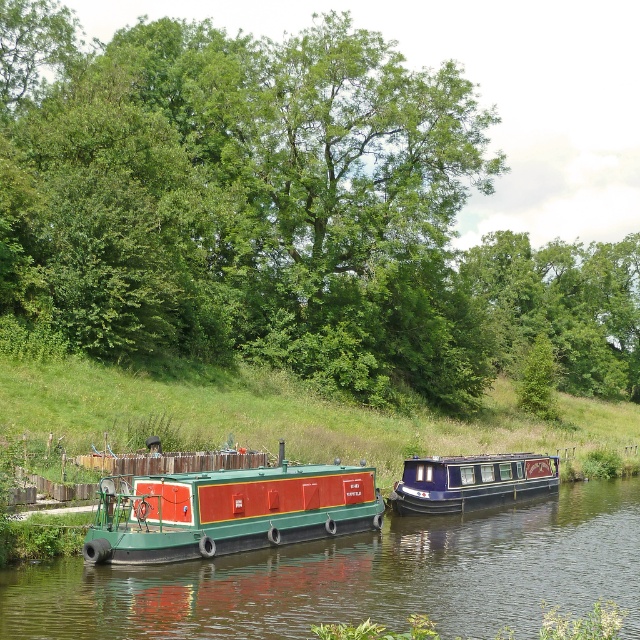
Question: Which object appears closest to the camera in this image?

Choices:
 (A) blue glossy houseboat at center
 (B) green rubber boat at lower left
 (C) green leafy tree at center
 (D) green matte barge at center

Answer: (B)

Question: Considering the real-world distances, which object is farthest from the blue glossy houseboat at center?

Choices:
 (A) green leafy tree at center
 (B) green rubber boat at lower left
 (C) green matte barge at center

Answer: (A)

Question: Is green rubber boat at lower left to the left of green matte barge at center from the viewer's perspective?

Choices:
 (A) no
 (B) yes

Answer: (A)

Question: Does green leafy tree at center have a lesser width compared to green matte barge at center?

Choices:
 (A) yes
 (B) no

Answer: (B)

Question: Considering the real-world distances, which object is farthest from the green leafy tree at center?

Choices:
 (A) green matte barge at center
 (B) blue glossy houseboat at center

Answer: (A)

Question: Can you confirm if green leafy tree at center is positioned to the right of green rubber boat at lower left?

Choices:
 (A) yes
 (B) no

Answer: (A)